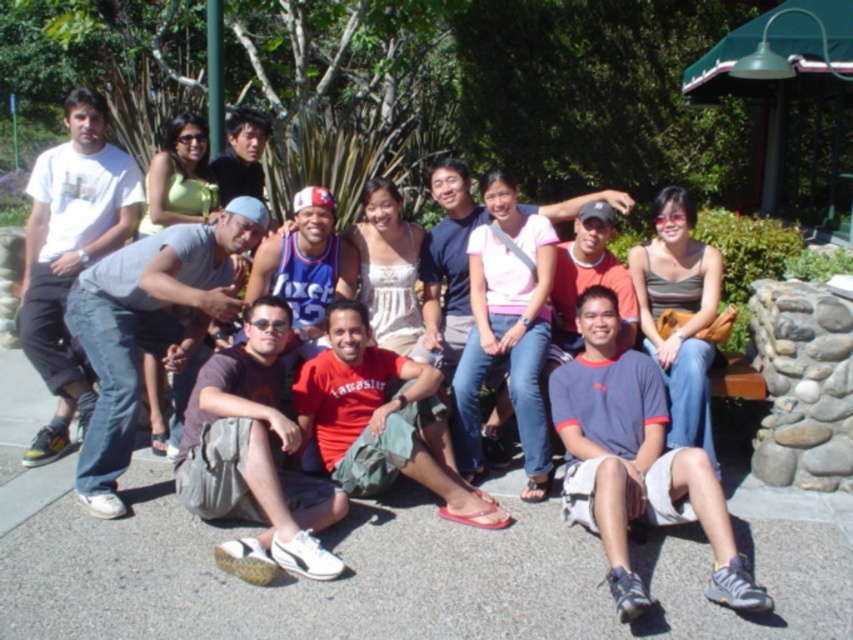
Can you confirm if gray denim jeans at center is positioned to the right of blue jersey at center?

Incorrect, gray denim jeans at center is not on the right side of blue jersey at center.

Does gray denim jeans at center appear over blue jersey at center?

No, gray denim jeans at center is not above blue jersey at center.

Who is more distant from viewer, [102,355] or [316,308]?

Positioned behind is point [316,308].

Locate an element on the screen. gray denim jeans at center is located at coordinates (149, 328).

Is white t-shirt at left below red matte shirt at center?

Incorrect, white t-shirt at left is not positioned below red matte shirt at center.

From the picture: Does white t-shirt at left have a lesser width compared to red matte shirt at center?

Yes, white t-shirt at left is thinner than red matte shirt at center.

Between point (56, 444) and point (305, 388), which one is positioned in front?

Point (305, 388)

This screenshot has height=640, width=853. Find the location of `white t-shirt at left`. white t-shirt at left is located at coordinates (70, 253).

Is gray denim jeans at center to the right of dark gray fabric bag at lower center from the viewer's perspective?

Incorrect, gray denim jeans at center is not on the right side of dark gray fabric bag at lower center.

Is point (229, 298) positioned after point (180, 481)?

Yes.

Image resolution: width=853 pixels, height=640 pixels. Identify the location of gray denim jeans at center. (149, 328).